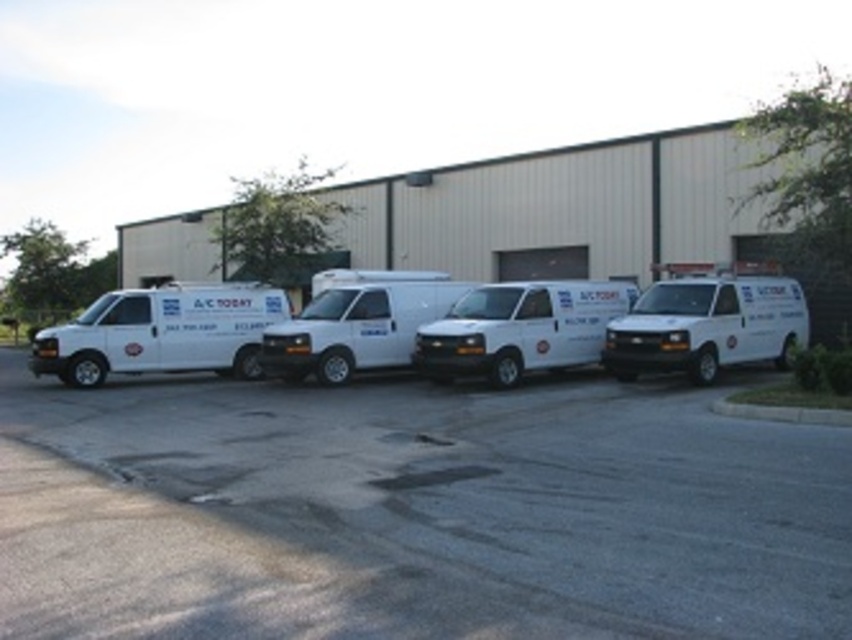
Who is lower down, white asphalt parking lot at center or white matte van at left?

white asphalt parking lot at center is lower down.

Can you confirm if white asphalt parking lot at center is positioned to the right of white matte van at left?

Yes, white asphalt parking lot at center is to the right of white matte van at left.

Where is `white asphalt parking lot at center`? The image size is (852, 640). white asphalt parking lot at center is located at coordinates (413, 512).

Between white matte van at left and white matte van at center, which one has less height?

Standing shorter between the two is white matte van at center.

Is point (119, 316) farther from camera compared to point (528, 340)?

Yes, point (119, 316) is behind point (528, 340).

Where is `white matte van at left`? This screenshot has width=852, height=640. white matte van at left is located at coordinates click(160, 332).

At what (x,y) coordinates should I click in order to perform the action: click on white matte van at left. Please return your answer as a coordinate pair (x, y). The height and width of the screenshot is (640, 852). Looking at the image, I should click on coord(160,332).

Is white asphalt parking lot at center closer to the viewer compared to white matte van at right?

Yes, it is.

Is white asphalt parking lot at center further to the viewer compared to white matte van at right?

No, it is not.

Which is behind, point (231, 460) or point (689, 333)?

The point (689, 333) is more distant.

This screenshot has height=640, width=852. I want to click on white asphalt parking lot at center, so click(413, 512).